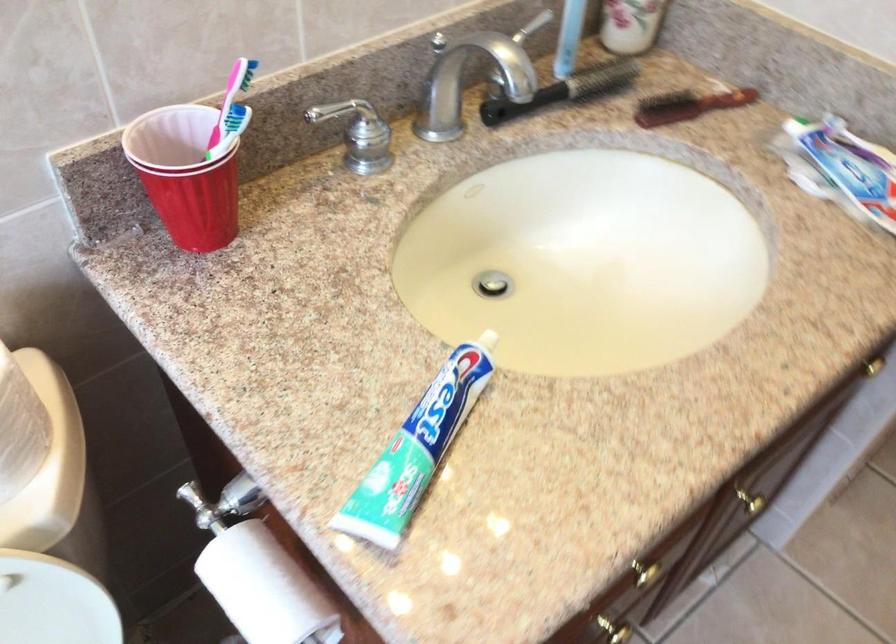
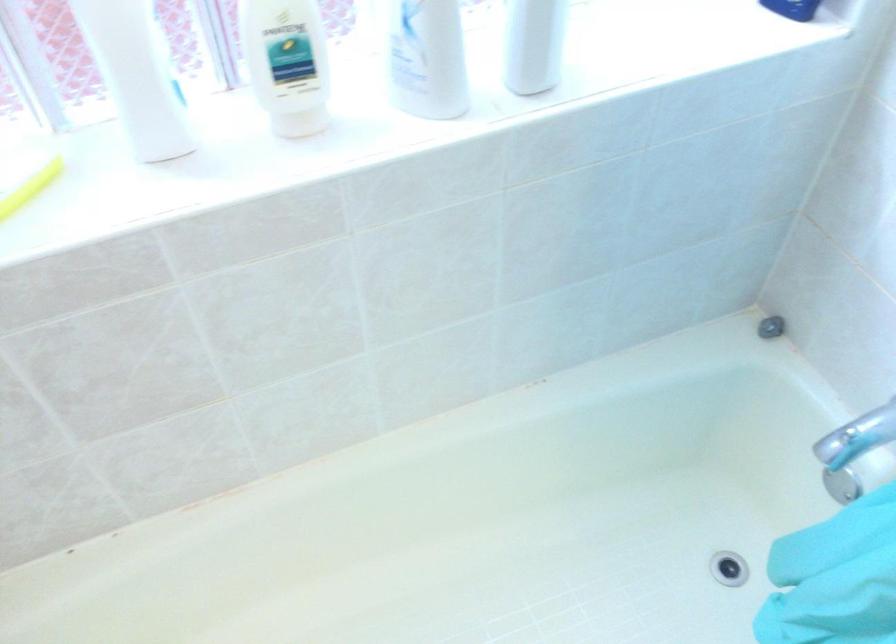
How did the camera likely rotate?

The camera's rotation is toward left-down.